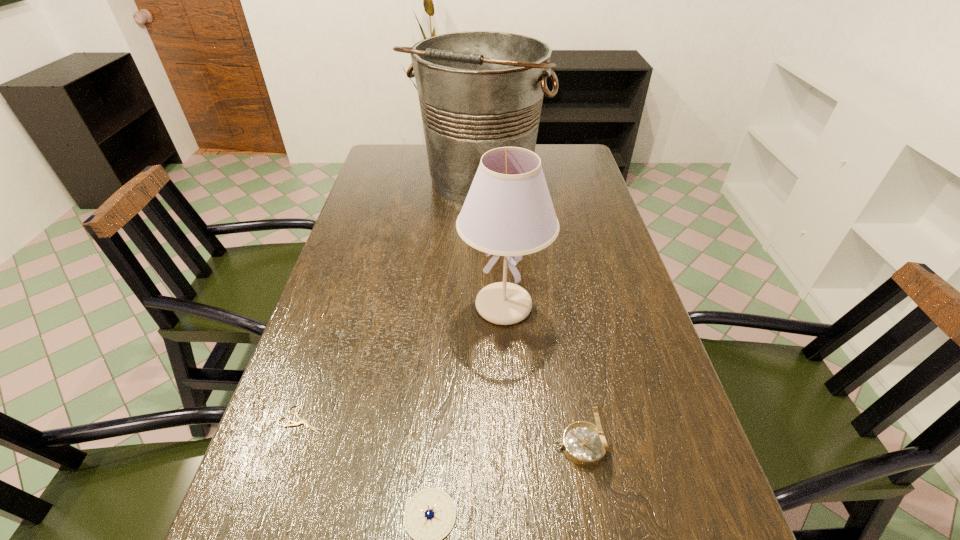
Find the location of `vacant space located with the dial facing the taller compass`. vacant space located with the dial facing the taller compass is located at coordinates (472, 446).

Where is `vacant area situated with the dial facing the taller compass`? The image size is (960, 540). vacant area situated with the dial facing the taller compass is located at coordinates (402, 446).

At what (x,y) coordinates should I click in order to perform the action: click on vacant area located 0.350m with the dial facing the taller compass. Please return your answer as a coordinate pair (x, y). Looking at the image, I should click on (364, 446).

You are a GUI agent. You are given a task and a screenshot of the screen. Output one action in this format:
    pyautogui.click(x=<x>, y=<y>)
    Task: Click on the vacant point located 0.360m on the back of the shortest object
    Image resolution: width=960 pixels, height=540 pixels.
    Given the screenshot: What is the action you would take?
    pyautogui.click(x=348, y=282)

You are a GUI agent. You are given a task and a screenshot of the screen. Output one action in this format:
    pyautogui.click(x=<x>, y=<y>)
    Task: Click on the object that is at the far edge
    
    Given the screenshot: What is the action you would take?
    pyautogui.click(x=478, y=90)

The image size is (960, 540). What are the coordinates of `bucket at the left edge` in the screenshot? It's located at (478, 90).

At what (x,y) coordinates should I click in order to perform the action: click on shears present at the left edge. Please return your answer as a coordinate pair (x, y). This screenshot has width=960, height=540. Looking at the image, I should click on (301, 421).

At what (x,y) coordinates should I click in order to perform the action: click on object positioned at the right edge. Please return your answer as a coordinate pair (x, y). The width and height of the screenshot is (960, 540). Looking at the image, I should click on (585, 444).

Identify the location of object located in the far left corner section of the desktop. (478, 90).

Locate an element on the screen. vacant space at the left edge is located at coordinates (310, 356).